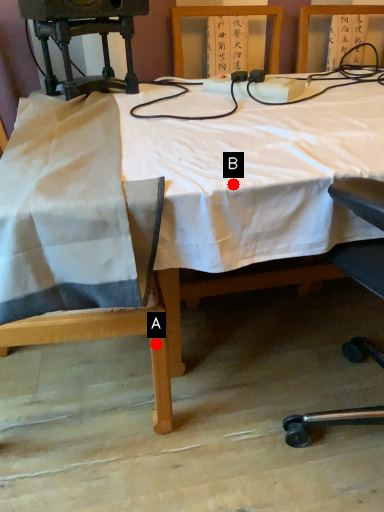
Question: Two points are circled on the image, labeled by A and B beside each circle. Which point is further to the camera?

Choices:
 (A) A is further
 (B) B is further

Answer: (A)